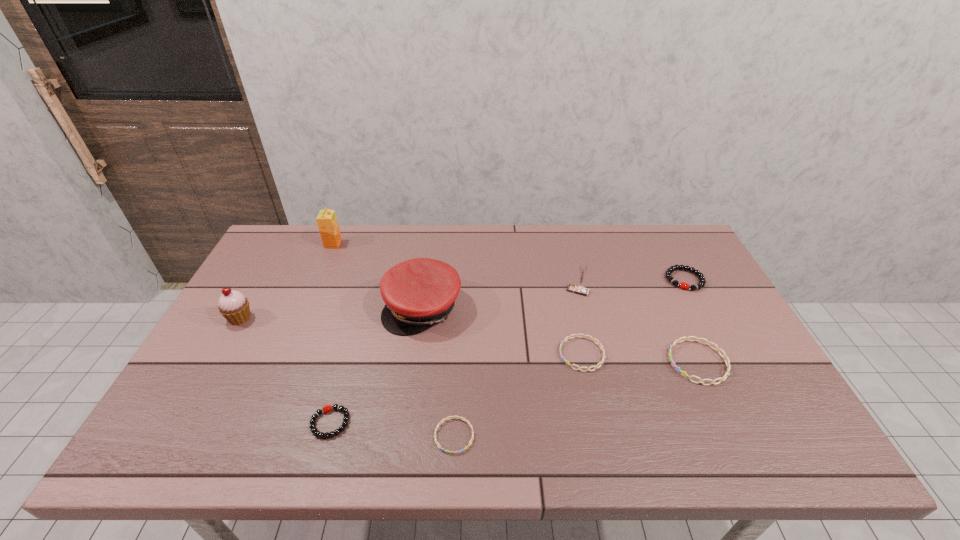
Locate an element on the screen. the left black bracelet is located at coordinates (328, 408).

Image resolution: width=960 pixels, height=540 pixels. I want to click on the nearer black bracelet, so click(328, 408).

Identify the location of the shortest object. The image size is (960, 540). (451, 452).

The width and height of the screenshot is (960, 540). I want to click on the nearest blue bracelet, so click(x=451, y=452).

Where is `vacant area situated 0.050m on the right of the tallest object`? vacant area situated 0.050m on the right of the tallest object is located at coordinates (355, 244).

The width and height of the screenshot is (960, 540). I want to click on free space located 0.120m on the left of the matchbox, so [527, 291].

Image resolution: width=960 pixels, height=540 pixels. Find the location of `vacant region located 0.180m on the front of the leftmost object`. vacant region located 0.180m on the front of the leftmost object is located at coordinates (204, 382).

The width and height of the screenshot is (960, 540). Identify the location of free space located on the front-facing side of the red cap. (413, 379).

Where is `vacant region located 0.270m on the surface of the rightmost blue bracelet showing star-shaped elements`? The image size is (960, 540). vacant region located 0.270m on the surface of the rightmost blue bracelet showing star-shaped elements is located at coordinates (565, 362).

Locate an element on the screen. The height and width of the screenshot is (540, 960). vacant area situated on the surface of the rightmost blue bracelet showing star-shaped elements is located at coordinates (604, 362).